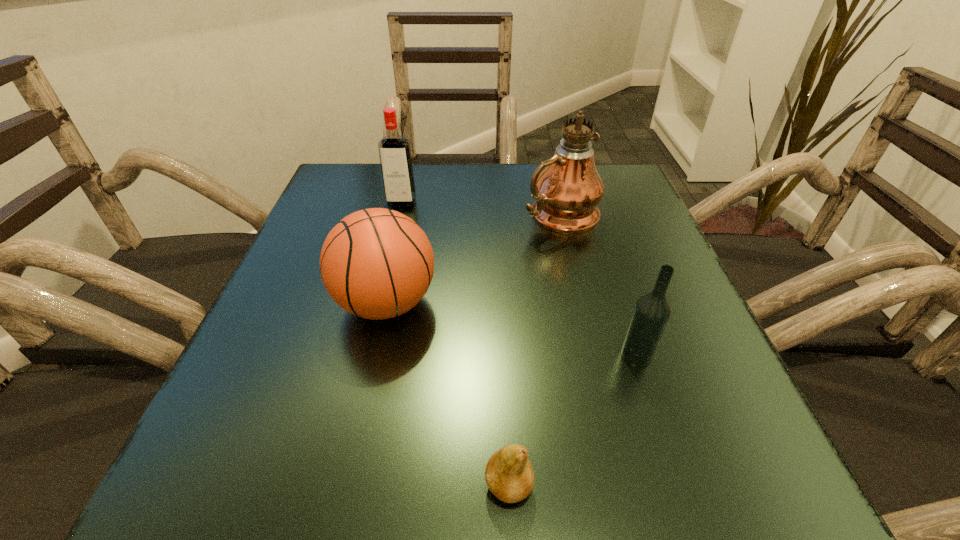
Find the location of `free spot that satisfies the following two spatial constraints: 1. on the front and back of the basketball; 2. on the right side of the taller vodka`. free spot that satisfies the following two spatial constraints: 1. on the front and back of the basketball; 2. on the right side of the taller vodka is located at coordinates coord(377,303).